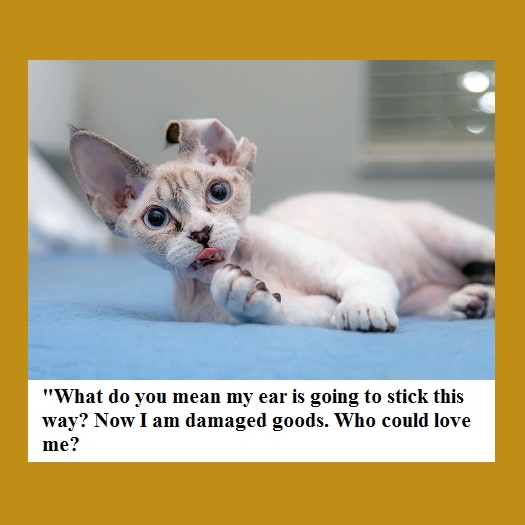
Find the location of `window`. window is located at coordinates (415, 105).